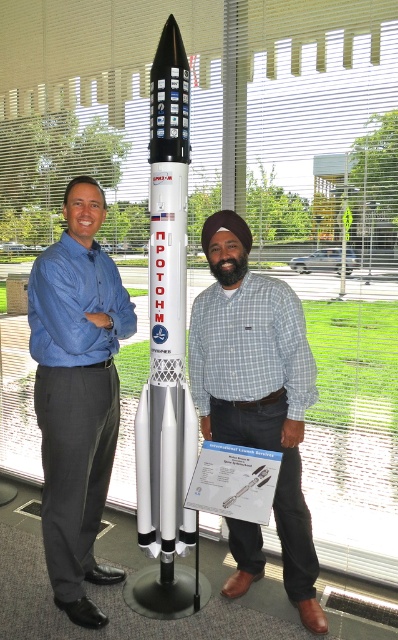
Question: Can you confirm if blue shirt at center is wider than checkered shirt at center?

Choices:
 (A) no
 (B) yes

Answer: (A)

Question: Which is nearer to the blue shirt at center?

Choices:
 (A) checkered shirt at center
 (B) white matte rocket at center

Answer: (B)

Question: Does blue shirt at center appear on the left side of white matte rocket at center?

Choices:
 (A) yes
 (B) no

Answer: (A)

Question: Among these objects, which one is nearest to the camera?

Choices:
 (A) white matte rocket at center
 (B) checkered shirt at center

Answer: (B)

Question: From the image, what is the correct spatial relationship of blue shirt at center in relation to white matte rocket at center?

Choices:
 (A) below
 (B) above

Answer: (A)

Question: Which point is closer to the camera?

Choices:
 (A) white matte rocket at center
 (B) checkered shirt at center
 (C) blue shirt at center

Answer: (C)